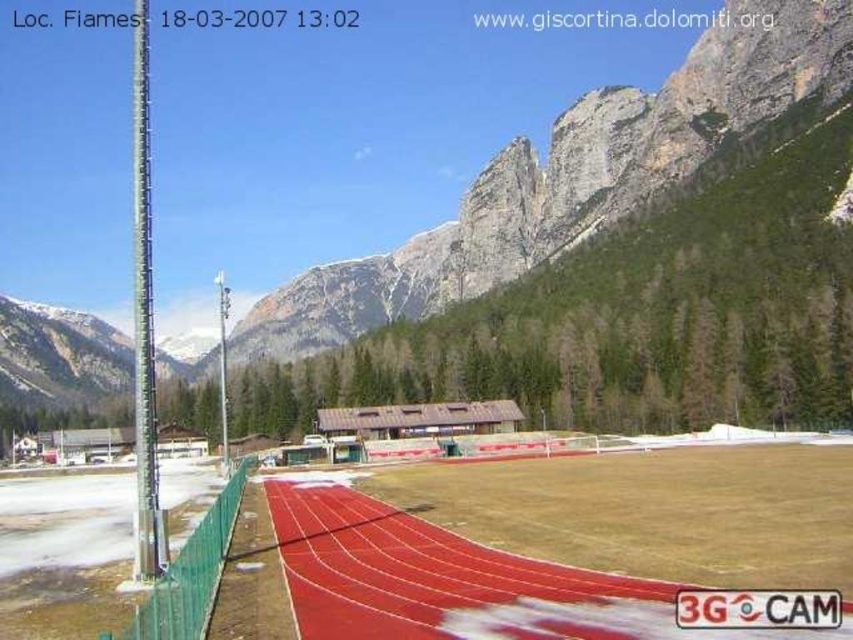
You are a runner preparing for a race and notice two poles on the track. The green metallic pole at left and the metallic pole at center. Which pole is closer to the starting line?

The green metallic pole at left is positioned over the metallic pole at center, so the metallic pole at center is closer to the starting line.